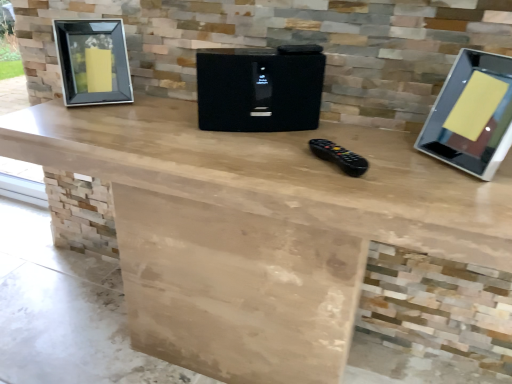
Question: Choose the correct answer: Is black plastic remote control at center inside black textured speaker at center or outside it?

Choices:
 (A) inside
 (B) outside

Answer: (B)

Question: From a real-world perspective, is black plastic remote control at center physically located above or below black textured speaker at center?

Choices:
 (A) below
 (B) above

Answer: (A)

Question: Which object is positioned farthest from the black glass picture frame at left?

Choices:
 (A) silver glossy monitor at right
 (B) black plastic remote control at center
 (C) black textured speaker at center

Answer: (A)

Question: Considering the real-world distances, which object is closest to the black textured speaker at center?

Choices:
 (A) black plastic remote control at center
 (B) black glass picture frame at left
 (C) silver glossy monitor at right

Answer: (A)